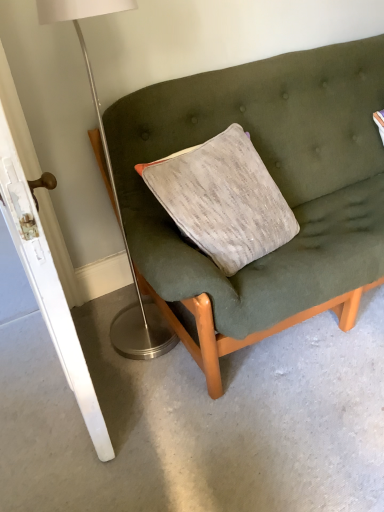
You are a GUI agent. You are given a task and a screenshot of the screen. Output one action in this format:
    pyautogui.click(x=<x>, y=<y>)
    Task: Click on the metallic silver floor lamp at left
    The width and height of the screenshot is (384, 512).
    Given the screenshot: What is the action you would take?
    pyautogui.click(x=116, y=200)

The width and height of the screenshot is (384, 512). Describe the element at coordinates (59, 309) in the screenshot. I see `white glossy door at left` at that location.

This screenshot has height=512, width=384. I want to click on textured fabric couch at center, so click(x=276, y=183).

Is metallic silver floor lamp at left surrounding white glossy door at left?

No.

Looking at this image, between metallic silver floor lamp at left and white glossy door at left, which one is positioned in front?

white glossy door at left is closer to the camera.

Does metallic silver floor lamp at left have a lesser height compared to white glossy door at left?

Correct, metallic silver floor lamp at left is not as tall as white glossy door at left.

Is metallic silver floor lamp at left aimed at white glossy door at left?

No.

Is metallic silver floor lamp at left facing away from textured fabric couch at center?

metallic silver floor lamp at left does not have its back to textured fabric couch at center.

From a real-world perspective, who is located lower, metallic silver floor lamp at left or textured fabric couch at center?

textured fabric couch at center is physically lower.

Is metallic silver floor lamp at left in front of textured fabric couch at center?

Yes, it is.

From the image's perspective, would you say metallic silver floor lamp at left is shown under textured fabric couch at center?

Yes, from the image's perspective, metallic silver floor lamp at left is beneath textured fabric couch at center.

Is textured fabric couch at center outside of white glossy door at left?

Indeed, textured fabric couch at center is completely outside white glossy door at left.

Looking at this image, how many degrees apart are the facing directions of textured fabric couch at center and white glossy door at left?

The facing directions of textured fabric couch at center and white glossy door at left are 98.3 degrees apart.

Can you confirm if textured fabric couch at center is smaller than white glossy door at left?

Correct, textured fabric couch at center occupies less space than white glossy door at left.

From a real-world perspective, who is located higher, textured fabric couch at center or white glossy door at left?

white glossy door at left.

Does white glossy door at left have a greater height compared to metallic silver floor lamp at left?

Yes, white glossy door at left is taller than metallic silver floor lamp at left.

From the image's perspective, is white glossy door at left located above or below metallic silver floor lamp at left?

From the image's perspective, white glossy door at left appears below metallic silver floor lamp at left.

Where is `door on the left of metallic silver floor lamp at left`? Image resolution: width=384 pixels, height=512 pixels. door on the left of metallic silver floor lamp at left is located at coordinates pos(59,309).

From a real-world perspective, is white glossy door at left over metallic silver floor lamp at left?

Yes.

Locate an element on the screen. The width and height of the screenshot is (384, 512). table lamp lying in front of the textured fabric couch at center is located at coordinates (116, 200).

Is textured fabric couch at center wider or thinner than metallic silver floor lamp at left?

Considering their sizes, textured fabric couch at center looks broader than metallic silver floor lamp at left.

Which is in front, textured fabric couch at center or metallic silver floor lamp at left?

metallic silver floor lamp at left is in front.

Measure the distance from white glossy door at left to textured fabric couch at center.

The distance of white glossy door at left from textured fabric couch at center is 31.50 inches.

Is point (64, 358) farther from viewer compared to point (362, 84)?

No, it is not.

Is white glossy door at left positioned in front of textured fabric couch at center?

Yes, it is in front of textured fabric couch at center.

Can you confirm if white glossy door at left is thinner than textured fabric couch at center?

Yes, white glossy door at left is thinner than textured fabric couch at center.

You are a GUI agent. You are given a task and a screenshot of the screen. Output one action in this format:
    pyautogui.click(x=<x>, y=<y>)
    Task: Click on the door above the metallic silver floor lamp at left (from a real-world perspective)
    The image size is (384, 512).
    Given the screenshot: What is the action you would take?
    pyautogui.click(x=59, y=309)

Locate an element on the screen. The image size is (384, 512). table lamp below the textured fabric couch at center (from the image's perspective) is located at coordinates (116, 200).

Based on their spatial positions, is white glossy door at left or textured fabric couch at center closer to metallic silver floor lamp at left?

Based on the image, white glossy door at left appears to be nearer to metallic silver floor lamp at left.

Estimate the real-world distances between objects in this image. Which object is further from textured fabric couch at center, metallic silver floor lamp at left or white glossy door at left?

Based on the image, white glossy door at left appears to be further to textured fabric couch at center.

Which object lies further to the anchor point metallic silver floor lamp at left, textured fabric couch at center or white glossy door at left?

The object further to metallic silver floor lamp at left is textured fabric couch at center.

Looking at this image, considering their positions, is textured fabric couch at center positioned closer to white glossy door at left than metallic silver floor lamp at left?

metallic silver floor lamp at left lies closer to white glossy door at left than the other object.

Estimate the real-world distances between objects in this image. Which object is closer to white glossy door at left, metallic silver floor lamp at left or textured fabric couch at center?

metallic silver floor lamp at left.

When comparing their distances from textured fabric couch at center, does white glossy door at left or metallic silver floor lamp at left seem further?

Based on the image, white glossy door at left appears to be further to textured fabric couch at center.

This screenshot has width=384, height=512. Identify the location of table lamp located between white glossy door at left and textured fabric couch at center in the left-right direction. (116, 200).